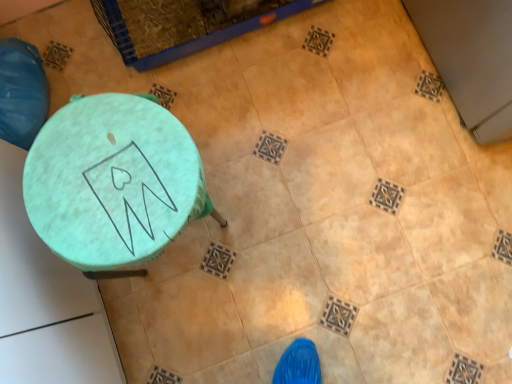
Question: Should I look upward or downward to see teal fabric-covered stool at lower left?

Choices:
 (A) up
 (B) down

Answer: (A)